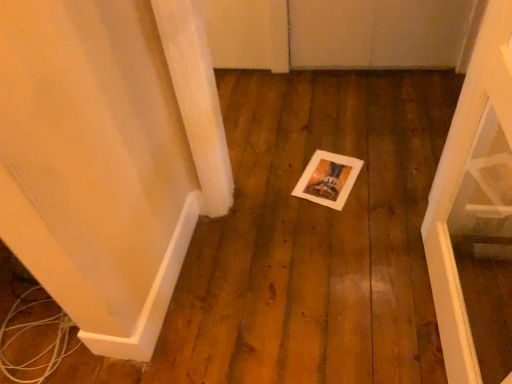
Question: From a real-world perspective, is white wood door at right under white paper postcard at center?

Choices:
 (A) no
 (B) yes

Answer: (A)

Question: Is the position of white wood door at right more distant than that of white paper postcard at center?

Choices:
 (A) yes
 (B) no

Answer: (B)

Question: Is white wood door at right with white paper postcard at center?

Choices:
 (A) yes
 (B) no

Answer: (B)

Question: Does white wood door at right have a greater height compared to white paper postcard at center?

Choices:
 (A) yes
 (B) no

Answer: (A)

Question: Is white wood door at right at the left side of white paper postcard at center?

Choices:
 (A) yes
 (B) no

Answer: (B)

Question: From the image's perspective, would you say white wood door at right is shown under white paper postcard at center?

Choices:
 (A) yes
 (B) no

Answer: (A)

Question: From a real-world perspective, is white paper postcard at center below white wood door at right?

Choices:
 (A) no
 (B) yes

Answer: (B)

Question: From a real-world perspective, is white paper postcard at center on top of white wood door at right?

Choices:
 (A) no
 (B) yes

Answer: (A)

Question: Considering the relative positions of white paper postcard at center and white wood door at right in the image provided, is white paper postcard at center in front of white wood door at right?

Choices:
 (A) yes
 (B) no

Answer: (B)

Question: Is white paper postcard at center thinner than white wood door at right?

Choices:
 (A) no
 (B) yes

Answer: (A)

Question: Is white paper postcard at center not within white wood door at right?

Choices:
 (A) no
 (B) yes

Answer: (B)

Question: Can you confirm if white paper postcard at center is positioned to the left of white wood door at right?

Choices:
 (A) yes
 (B) no

Answer: (A)

Question: Is white wood door at right bigger or smaller than white paper postcard at center?

Choices:
 (A) big
 (B) small

Answer: (A)